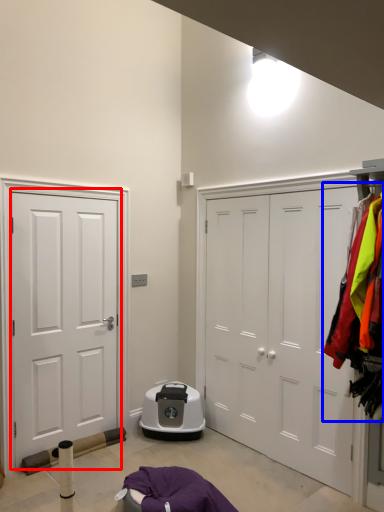
Question: Among these objects, which one is farthest to the camera, door (highlighted by a red box) or laundry (highlighted by a blue box)?

Choices:
 (A) door
 (B) laundry

Answer: (A)